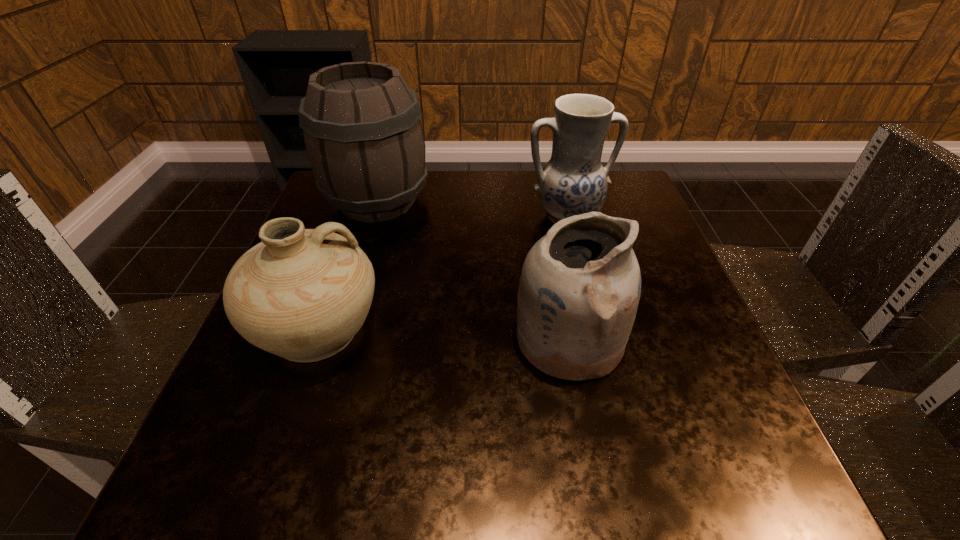
At what (x,y) coordinates should I click in order to perform the action: click on blank region between the farthest pottery and the leftmost pottery. Please return your answer as a coordinate pair (x, y). The height and width of the screenshot is (540, 960). Looking at the image, I should click on (443, 273).

The height and width of the screenshot is (540, 960). Find the location of `free spot between the wine bucket and the farthest pottery`. free spot between the wine bucket and the farthest pottery is located at coordinates (472, 208).

This screenshot has width=960, height=540. What are the coordinates of `the second closest object to the leftmost pottery` in the screenshot? It's located at (579, 290).

Identify which object is the second nearest to the leftmost pottery. Please provide its 2D coordinates. Your answer should be formatted as a tuple, i.e. [(x, y)], where the tuple contains the x and y coordinates of a point satisfying the conditions above.

[(579, 290)]

Choose which pottery is the second nearest neighbor to the leftmost pottery. Please provide its 2D coordinates. Your answer should be formatted as a tuple, i.e. [(x, y)], where the tuple contains the x and y coordinates of a point satisfying the conditions above.

[(573, 182)]

Select which pottery appears as the second closest to the farthest pottery. Please provide its 2D coordinates. Your answer should be formatted as a tuple, i.e. [(x, y)], where the tuple contains the x and y coordinates of a point satisfying the conditions above.

[(302, 294)]

Where is `free space that satisfies the following two spatial constraints: 1. on the back side of the wine bucket; 2. on the right side of the leftmost pottery`? The height and width of the screenshot is (540, 960). free space that satisfies the following two spatial constraints: 1. on the back side of the wine bucket; 2. on the right side of the leftmost pottery is located at coordinates (363, 201).